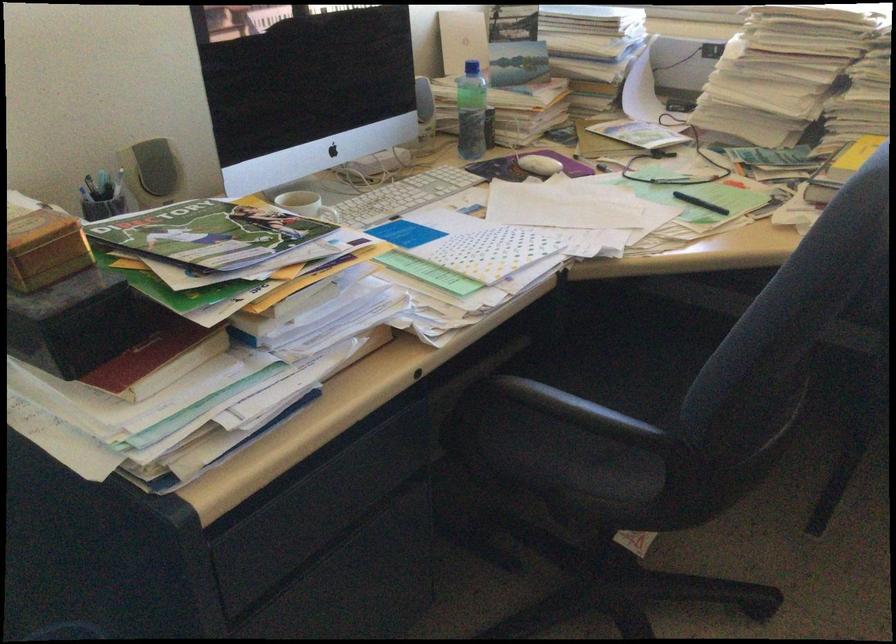
Where would you lift the plastic water bottle? Please return your answer as a coordinate pair (x, y).

(470, 111)